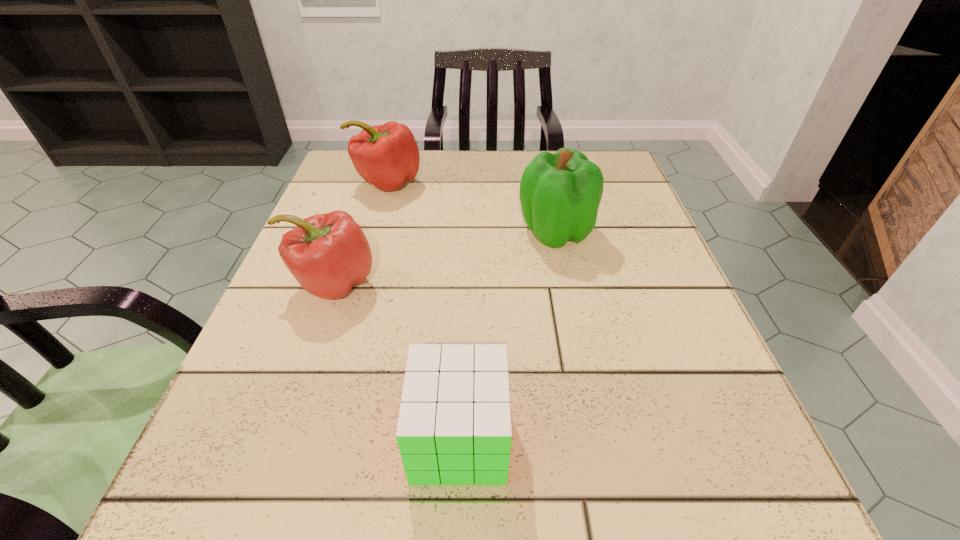
What are the coordinates of `vacant region at the far right corner` in the screenshot? It's located at (622, 167).

At what (x,y) coordinates should I click in order to perform the action: click on vacant space at the near right corner of the desktop. Please return your answer as a coordinate pair (x, y). The image size is (960, 540). Looking at the image, I should click on (739, 494).

Locate an element on the screen. free area in between the shortest object and the farthest bell pepper is located at coordinates (423, 310).

This screenshot has width=960, height=540. In order to click on free space that is in between the cube and the nearest bell pepper in this screenshot , I will do `click(396, 361)`.

The height and width of the screenshot is (540, 960). In order to click on free space between the tallest object and the second object from right to left in this screenshot , I will do `click(507, 335)`.

The image size is (960, 540). Identify the location of free point between the farthest bell pepper and the shortest object. (423, 310).

The width and height of the screenshot is (960, 540). Find the location of `vacant area that lies between the nearest object and the farthest bell pepper`. vacant area that lies between the nearest object and the farthest bell pepper is located at coordinates (423, 310).

Find the location of a particular element. Image resolution: width=960 pixels, height=540 pixels. free space between the rightmost object and the shortest object is located at coordinates coord(507,335).

You are a GUI agent. You are given a task and a screenshot of the screen. Output one action in this format:
    pyautogui.click(x=<x>, y=<y>)
    Task: Click on the empty space between the rightmost bell pepper and the farthest bell pepper
    Image resolution: width=960 pixels, height=540 pixels.
    Given the screenshot: What is the action you would take?
    pyautogui.click(x=471, y=207)

Find the location of `empty space between the rightmost object and the farthest object`. empty space between the rightmost object and the farthest object is located at coordinates (471, 207).